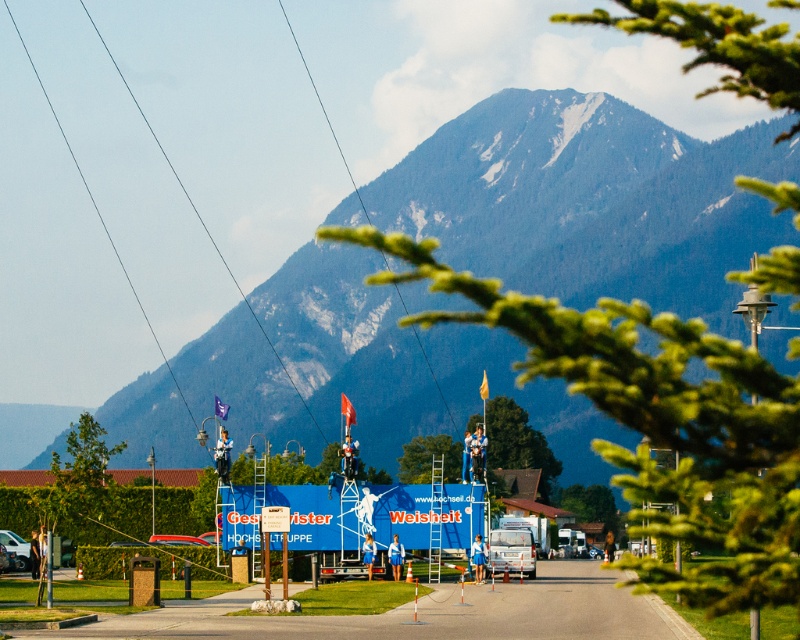
You are a photographer planning to capture a landscape shot of the green forested mountain at upper center and the metallic silver car at center. Given their sizes, which object should you focus on to ensure it takes up more of the frame?

The green forested mountain at upper center should be focused on since it has a larger size compared to the metallic silver car at center, making it occupy more of the frame.

You are a photographer standing at the location of the metallic silver car at center. You want to take a photo of the green forested mountain at upper center. Considering the distance between them, do you think you can capture the entire mountain in your shot without moving your camera position?

The distance between the green forested mountain at upper center and the metallic silver car at center is 211.28 meters. Since the mountain is far away, its image would appear smaller in the frame, but whether the entire mountain can be captured depends on the camera lens. A wide angle lens could potentially include the entire mountain from your current position.

From the picture: You are a photographer planning to take a landscape photo of the green forested mountain at upper center and the metallic silver car at center. Which object should you focus on first if you want to capture both in the same frame without moving the camera?

The green forested mountain at upper center is taller than the metallic silver car at center, so you should focus on the green forested mountain at upper center first to ensure it fits within the frame.